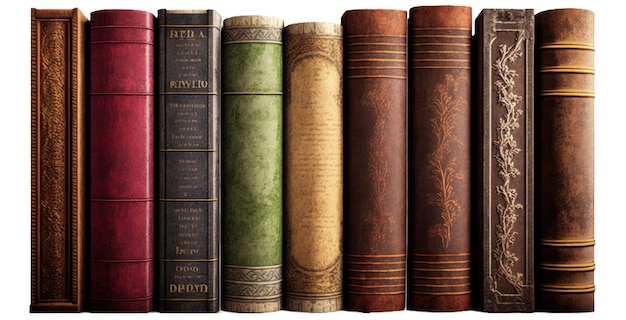
The width and height of the screenshot is (626, 320). Find the location of `books`. books is located at coordinates (59, 102), (106, 122), (193, 137), (258, 156), (321, 176), (370, 180), (444, 180), (515, 192), (581, 197).